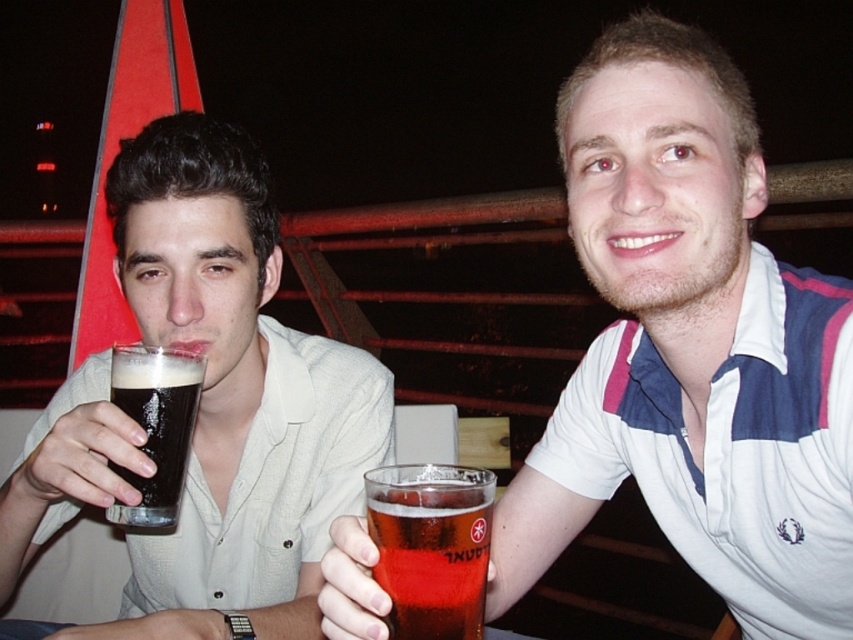
Is translucent glass at center to the left of translucent glass beer at center from the viewer's perspective?

Incorrect, translucent glass at center is not on the left side of translucent glass beer at center.

Is point (602, 339) positioned before point (453, 611)?

No.

Where is `translucent glass at center`? translucent glass at center is located at coordinates coord(691,349).

Between translucent glass beer at center and dark matte glass at left, which one has less height?

With less height is translucent glass beer at center.

Who is positioned more to the right, translucent glass beer at center or dark matte glass at left?

Positioned to the right is translucent glass beer at center.

Locate an element on the screen. The width and height of the screenshot is (853, 640). translucent glass beer at center is located at coordinates (431, 547).

Between point (798, 465) and point (160, 477), which one is positioned behind?

Positioned behind is point (160, 477).

Which is more to the right, white cotton polo shirt at upper right or dark matte glass at left?

white cotton polo shirt at upper right is more to the right.

Describe the element at coordinates (733, 451) in the screenshot. Image resolution: width=853 pixels, height=640 pixels. I see `white cotton polo shirt at upper right` at that location.

Where is `white cotton polo shirt at upper right`? This screenshot has width=853, height=640. white cotton polo shirt at upper right is located at coordinates (733, 451).